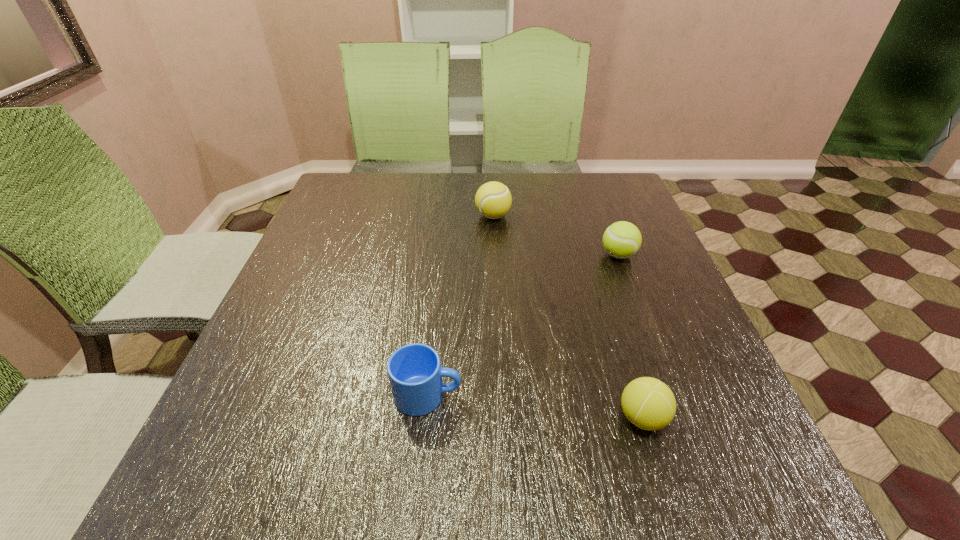
Locate an element on the screen. The image size is (960, 540). free spot between the nearest tennis ball and the farthest tennis ball is located at coordinates (567, 316).

Image resolution: width=960 pixels, height=540 pixels. Find the location of `unoccupied position between the leftmost object and the third object from right to left`. unoccupied position between the leftmost object and the third object from right to left is located at coordinates (461, 306).

The width and height of the screenshot is (960, 540). What are the coordinates of `empty space that is in between the nearest tennis ball and the mug` in the screenshot? It's located at (535, 406).

What are the coordinates of `empty space between the third object from right to left and the second farthest tennis ball` in the screenshot? It's located at (556, 235).

This screenshot has height=540, width=960. In order to click on free space between the leftmost tennis ball and the second farthest tennis ball in this screenshot , I will do `click(556, 235)`.

Identify the location of free space between the nearest tennis ball and the farthest object. Image resolution: width=960 pixels, height=540 pixels. (567, 316).

What are the coordinates of `empty space between the second object from left to right and the second farthest tennis ball` in the screenshot? It's located at (556, 235).

Image resolution: width=960 pixels, height=540 pixels. I want to click on the closest object to the mug, so click(x=648, y=403).

Point out which object is positioned as the nearest to the leftmost object. Please provide its 2D coordinates. Your answer should be formatted as a tuple, i.e. [(x, y)], where the tuple contains the x and y coordinates of a point satisfying the conditions above.

[(648, 403)]

Identify which tennis ball is the second nearest to the leftmost object. Please provide its 2D coordinates. Your answer should be formatted as a tuple, i.e. [(x, y)], where the tuple contains the x and y coordinates of a point satisfying the conditions above.

[(622, 239)]